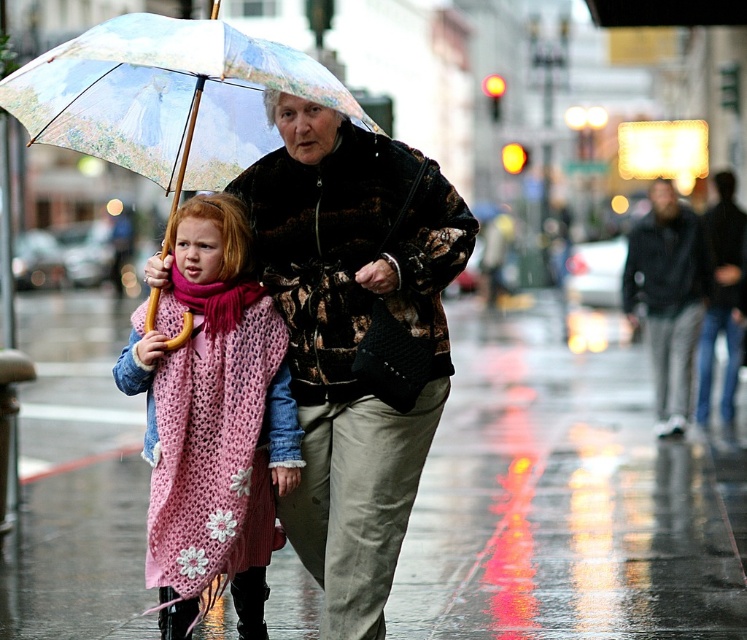
You are a pedestrian trying to cross the street while avoiding puddles. If you walk between the pink knitted scarf at lower left and the dark gray jeans at right, will you step into a puddle?

The pink knitted scarf at lower left is in front of dark gray jeans at right, meaning there is no space between them for a puddle. Therefore, you won